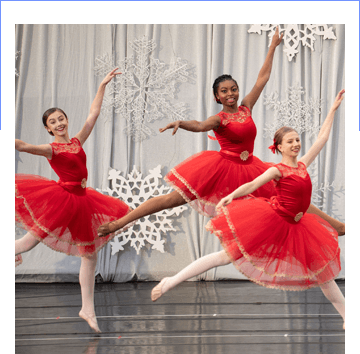
Find the location of a particular element. Image resolution: width=360 pixels, height=354 pixels. black floor is located at coordinates click(x=165, y=325).